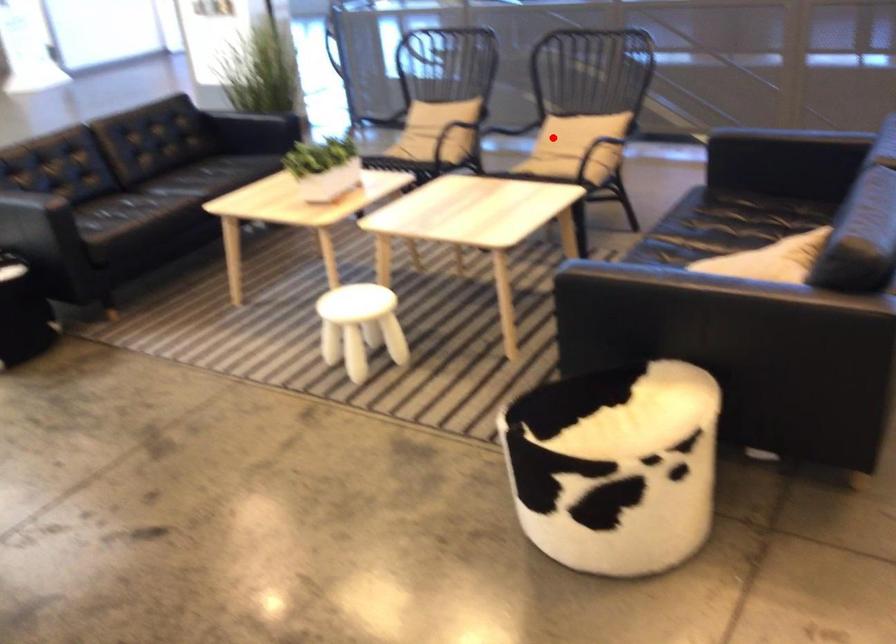
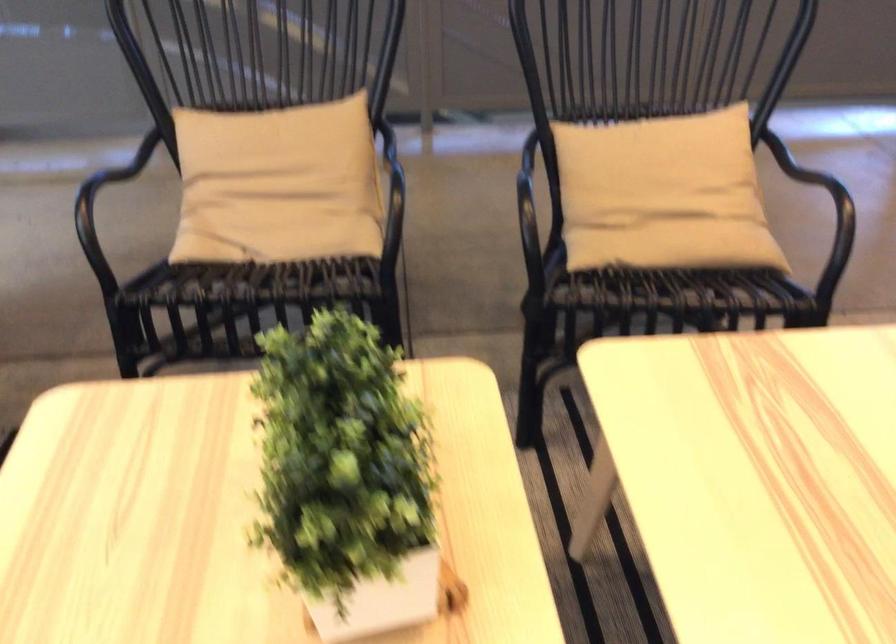
Question: I am providing you with two images of the same scene from different viewpoints. Image1 has a red point marked. In image2, the corresponding 3D location appears at what relative position? Reply with the corresponding letter.

Choices:
 (A) Closer
 (B) Farther

Answer: (A)